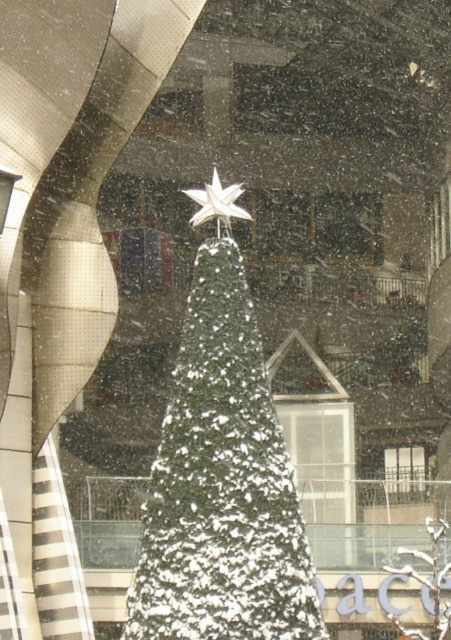
Between point (243, 189) and point (405, 481), which one is positioned behind?

The point (405, 481) is behind.

Is white glossy star at center smaller than clear glass window at center?

Yes, white glossy star at center is smaller than clear glass window at center.

Is point (217, 202) positioned in front of point (389, 465)?

Yes.

You are a GUI agent. You are given a task and a screenshot of the screen. Output one action in this format:
    pyautogui.click(x=<x>, y=<y>)
    Task: Click on the white glossy star at center
    This screenshot has width=451, height=640.
    Given the screenshot: What is the action you would take?
    pyautogui.click(x=216, y=202)

Can you confirm if snow-covered green christmas tree at center is positioned below clear glass window at center?

No, snow-covered green christmas tree at center is not below clear glass window at center.

Where is `snow-covered green christmas tree at center`? This screenshot has width=451, height=640. snow-covered green christmas tree at center is located at coordinates (221, 483).

Is point (225, 573) more distant than point (389, 449)?

No, it is in front of (389, 449).

At what (x,y) coordinates should I click in order to perform the action: click on snow-covered green christmas tree at center. Please return your answer as a coordinate pair (x, y). Looking at the image, I should click on (221, 483).

Does snow-covered green christmas tree at center have a greater width compared to white glossy star at center?

Yes, snow-covered green christmas tree at center is wider than white glossy star at center.

Does snow-covered green christmas tree at center appear under white glossy star at center?

Yes.

Locate an element on the screen. Image resolution: width=451 pixels, height=640 pixels. snow-covered green christmas tree at center is located at coordinates (221, 483).